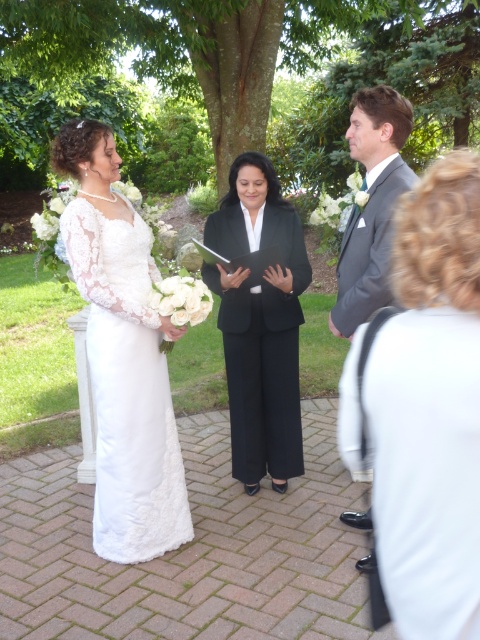
You are a photographer positioned at the back of the garden. You need to capture a photo of both the white lace dress at left and the matte gray suit at center without any obstructions. Based on their positions, can you frame both subjects in the same shot?

The matte gray suit at center is behind the white lace dress at left, so the photographer can frame both subjects in the same shot since the groom is positioned behind the bride and not blocking the view.

From the picture: You are a photographer at a wedding. You need to position yourself so that both the satin black dress at center and the matte gray suit at center are in frame. Which subject should you focus on first to ensure both are visible?

The satin black dress at center is shorter than the matte gray suit at center, so you should focus on the shorter one first to ensure both are visible in the frame.

You are attending a wedding and see two dresses in the scene. The satin black dress at center and the white lace dress at left. Which one is smaller in size?

The satin black dress at center is smaller than the white lace dress at left.